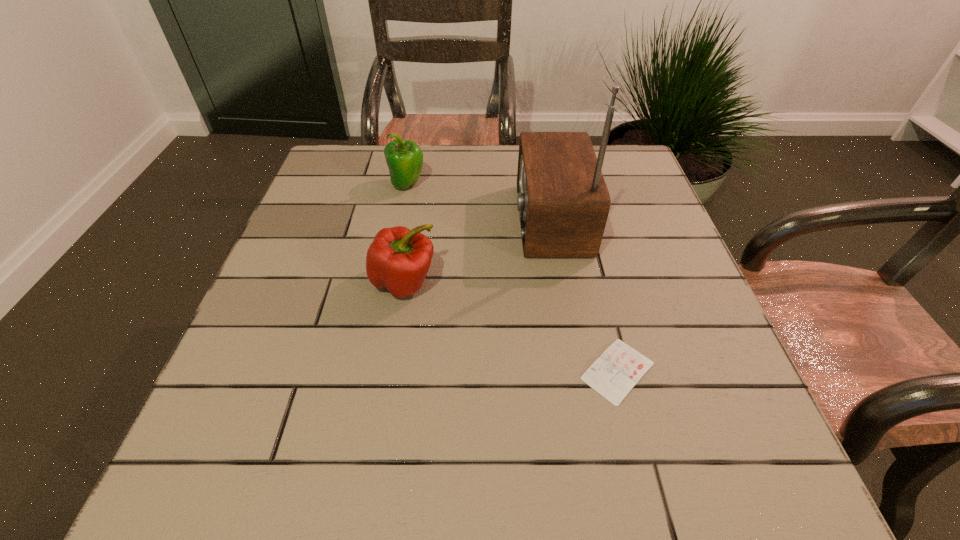
Image resolution: width=960 pixels, height=540 pixels. In order to click on radio receiver in this screenshot , I will do `click(563, 202)`.

This screenshot has width=960, height=540. Find the location of `the farther bell pepper`. the farther bell pepper is located at coordinates (404, 159).

Where is `the second tallest object`? This screenshot has width=960, height=540. the second tallest object is located at coordinates (404, 159).

I want to click on the nearer bell pepper, so click(x=398, y=259).

Image resolution: width=960 pixels, height=540 pixels. In order to click on the third tallest object in this screenshot , I will do `click(398, 259)`.

Where is `the nearest object`? Image resolution: width=960 pixels, height=540 pixels. the nearest object is located at coordinates (620, 367).

The image size is (960, 540). I want to click on diary, so click(x=620, y=367).

I want to click on vacant space located 0.230m on the front-facing side of the radio receiver, so click(x=419, y=220).

At what (x,y) coordinates should I click in order to perform the action: click on free space located 0.250m on the front-facing side of the radio receiver. Please return your answer as a coordinate pair (x, y). Looking at the image, I should click on (410, 220).

Locate an element on the screen. Image resolution: width=960 pixels, height=540 pixels. vacant space located 0.230m on the front-facing side of the radio receiver is located at coordinates (419, 220).